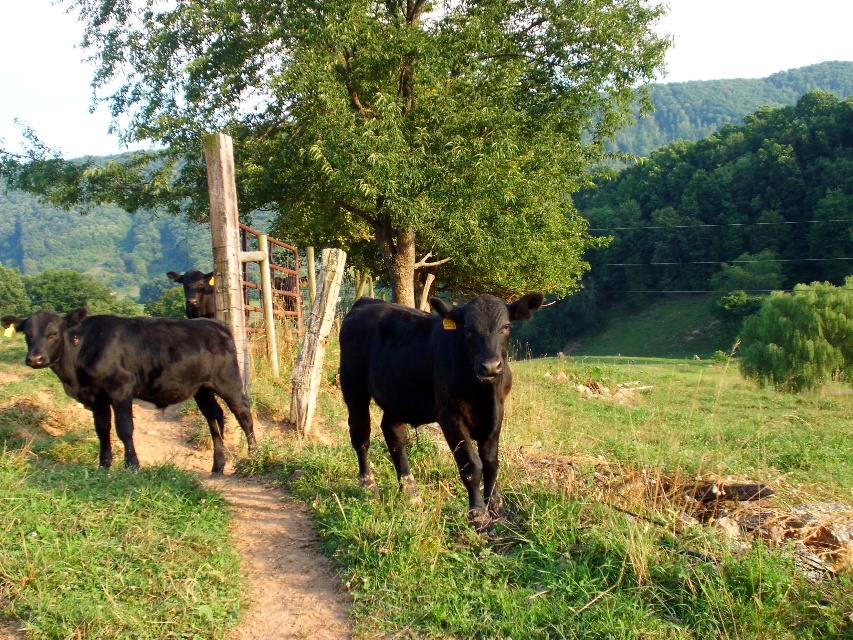
Is green leafy tree at center positioned at the back of green leafy tree at right?

No.

Which is behind, point (398, 145) or point (750, 349)?

Point (750, 349)

What are the coordinates of `green leafy tree at center` in the screenshot? It's located at (370, 124).

Does green leafy tree at center have a smaller size compared to dirt path at center?

No.

The height and width of the screenshot is (640, 853). What do you see at coordinates (370, 124) in the screenshot?
I see `green leafy tree at center` at bounding box center [370, 124].

Identify the location of green leafy tree at center. (370, 124).

Locate an element on the screen. This screenshot has height=640, width=853. black glossy cow at center is located at coordinates (432, 384).

Is black glossy cow at center to the right of green leafy tree at right from the viewer's perspective?

In fact, black glossy cow at center is to the left of green leafy tree at right.

Which is in front, point (395, 449) or point (767, 368)?

Point (395, 449)

You are a GUI agent. You are given a task and a screenshot of the screen. Output one action in this format:
    pyautogui.click(x=<x>, y=<y>)
    Task: Click on the black glossy cow at center
    The width and height of the screenshot is (853, 640).
    Given the screenshot: What is the action you would take?
    pyautogui.click(x=432, y=384)